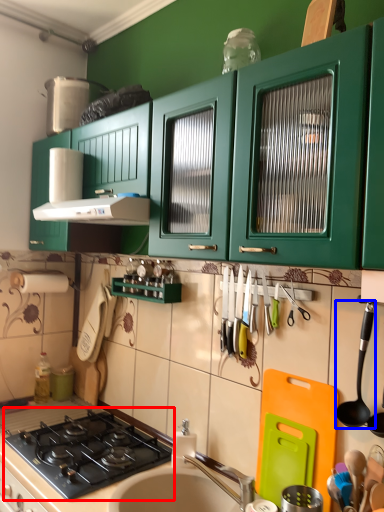
Question: Which object appears farthest to the camera in this image, gas stove (highlighted by a red box) or utensil (highlighted by a blue box)?

Choices:
 (A) gas stove
 (B) utensil

Answer: (A)